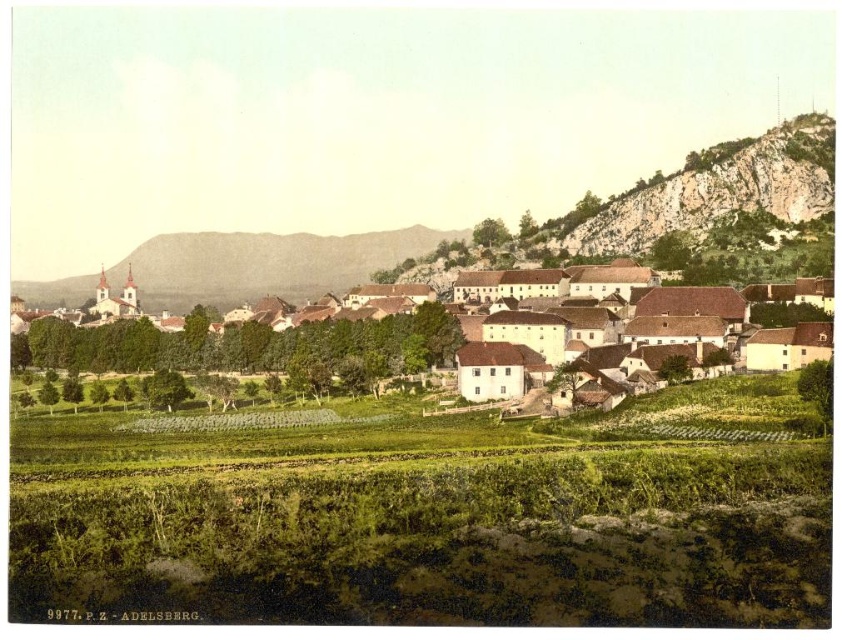
Who is shorter, green grassy vineyard at center or white matte buildings at center?

With less height is green grassy vineyard at center.

You are a GUI agent. You are given a task and a screenshot of the screen. Output one action in this format:
    pyautogui.click(x=<x>, y=<y>)
    Task: Click on the green grassy vineyard at center
    
    Given the screenshot: What is the action you would take?
    pyautogui.click(x=438, y=520)

Describe the element at coordinates (438, 520) in the screenshot. I see `green grassy vineyard at center` at that location.

The image size is (842, 640). Find the location of `green grassy vineyard at center`. green grassy vineyard at center is located at coordinates (438, 520).